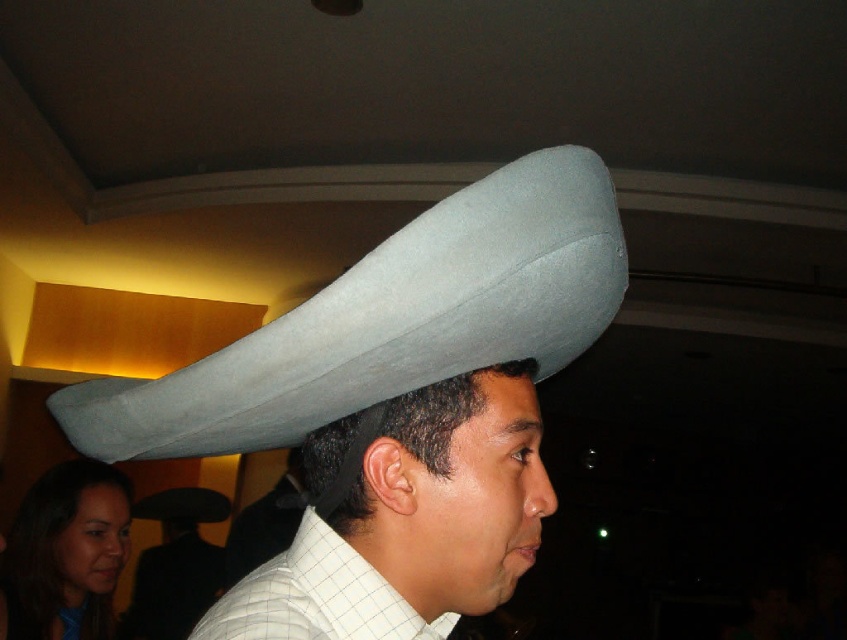
Question: Is dark gray felt sombrero at upper center positioned before gray felt hat at upper center?

Choices:
 (A) no
 (B) yes

Answer: (B)

Question: Considering the real-world distances, which object is closest to the white checkered shirt at center?

Choices:
 (A) white felt hat at upper center
 (B) gray felt cowboy hat at upper center

Answer: (B)

Question: Does gray felt cowboy hat at upper center appear under gray felt hat at upper center?

Choices:
 (A) no
 (B) yes

Answer: (A)

Question: Which point is closer to the camera?

Choices:
 (A) white checkered shirt at center
 (B) dark gray felt sombrero at upper center

Answer: (A)

Question: Can you confirm if white checkered shirt at center is smaller than white felt hat at upper center?

Choices:
 (A) no
 (B) yes

Answer: (B)

Question: Estimate the real-world distances between objects in this image. Which object is farther from the felt hat at center?

Choices:
 (A) gray felt cowboy hat at upper center
 (B) gray felt hat at upper center

Answer: (B)